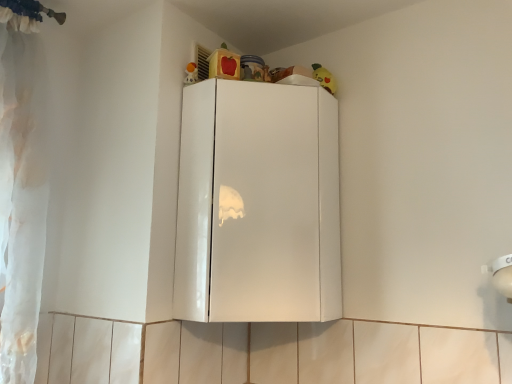
Question: Based on their sizes in the image, would you say glossy white cabinet at upper center is bigger or smaller than yellow plush toy at upper right, which is the 1th toy from back to front?

Choices:
 (A) big
 (B) small

Answer: (A)

Question: From a real-world perspective, is glossy white cabinet at upper center positioned above or below yellow plush toy at upper right, which appears as the 2th toy when viewed from the front?

Choices:
 (A) below
 (B) above

Answer: (A)

Question: Which object is the farthest from the yellow plush toy at upper right, arranged as the 2th toy when viewed from the left?

Choices:
 (A) matte plastic toy at upper center, marked as the first toy in a front-to-back arrangement
 (B) glossy white cabinet at upper center

Answer: (B)

Question: Which object is the closest to the yellow plush toy at upper right, arranged as the 2th toy when viewed from the left?

Choices:
 (A) glossy white cabinet at upper center
 (B) matte plastic toy at upper center, arranged as the first toy when viewed from the left

Answer: (B)